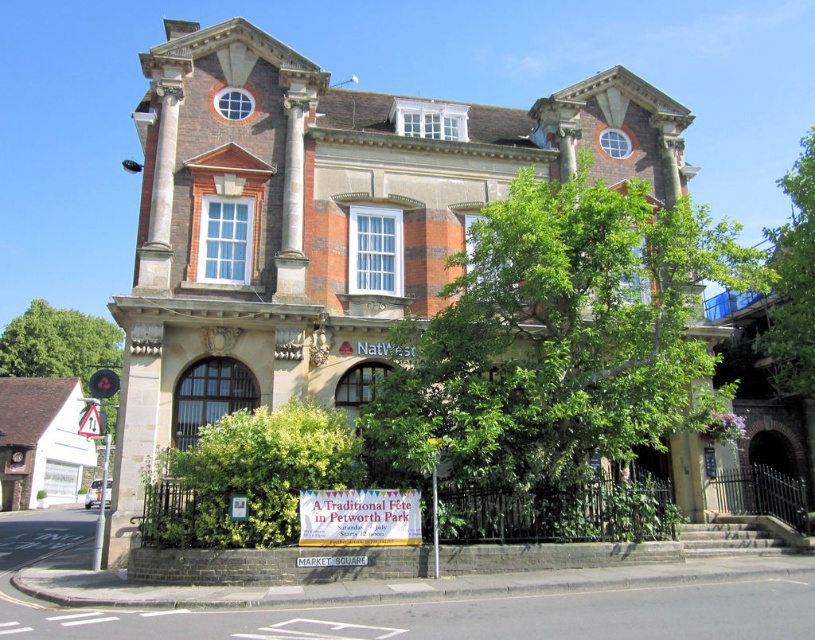
Which is more to the left, white paper sign at center or yellow plastic triangular at left?

yellow plastic triangular at left

Which is behind, point (306, 518) or point (87, 435)?

The point (87, 435) is behind.

At what (x,y) coordinates should I click in order to perform the action: click on white paper sign at center. Please return your answer as a coordinate pair (x, y). The image size is (815, 640). Looking at the image, I should click on (359, 516).

Between point (333, 435) and point (336, 515), which one is positioned behind?

The point (333, 435) is more distant.

Does green leafy bush at lower center have a lesser height compared to white paper sign at center?

No, green leafy bush at lower center is not shorter than white paper sign at center.

In order to click on green leafy bush at lower center in this screenshot , I will do `click(250, 476)`.

Between green leafy tree at upper right and green leafy tree at left, which one has more height?

green leafy tree at upper right is taller.

Is point (805, 326) positioned in front of point (113, 332)?

Yes, point (805, 326) is closer to viewer.

Where is `green leafy tree at upper right`? Image resolution: width=815 pixels, height=640 pixels. green leafy tree at upper right is located at coordinates point(794,282).